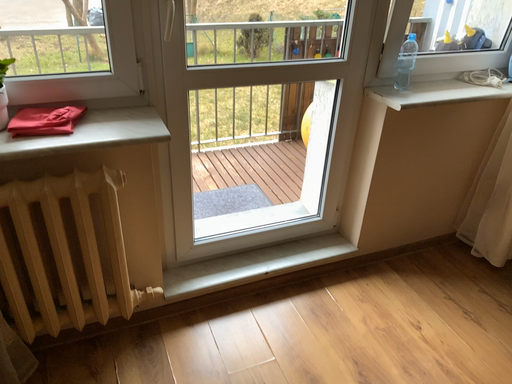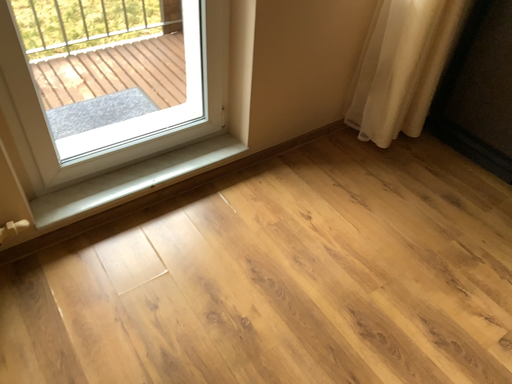
Question: How did the camera likely rotate when shooting the video?

Choices:
 (A) rotated left
 (B) rotated right

Answer: (B)